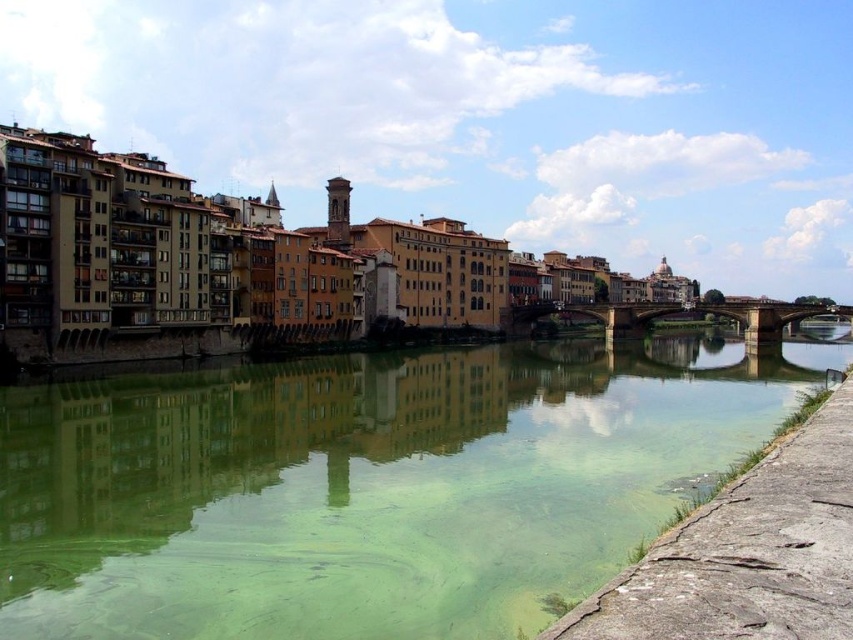
Between green translucent water at lower center and stone bridge at center, which one is positioned lower?

green translucent water at lower center is lower down.

Can you confirm if green translucent water at lower center is smaller than stone bridge at center?

Incorrect, green translucent water at lower center is not smaller in size than stone bridge at center.

The height and width of the screenshot is (640, 853). In order to click on green translucent water at lower center in this screenshot , I will do `click(366, 486)`.